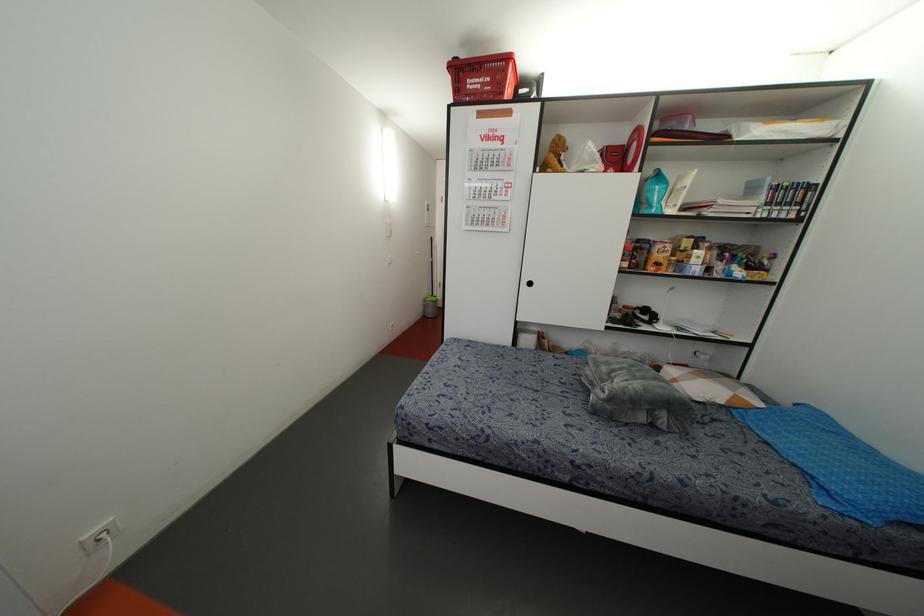
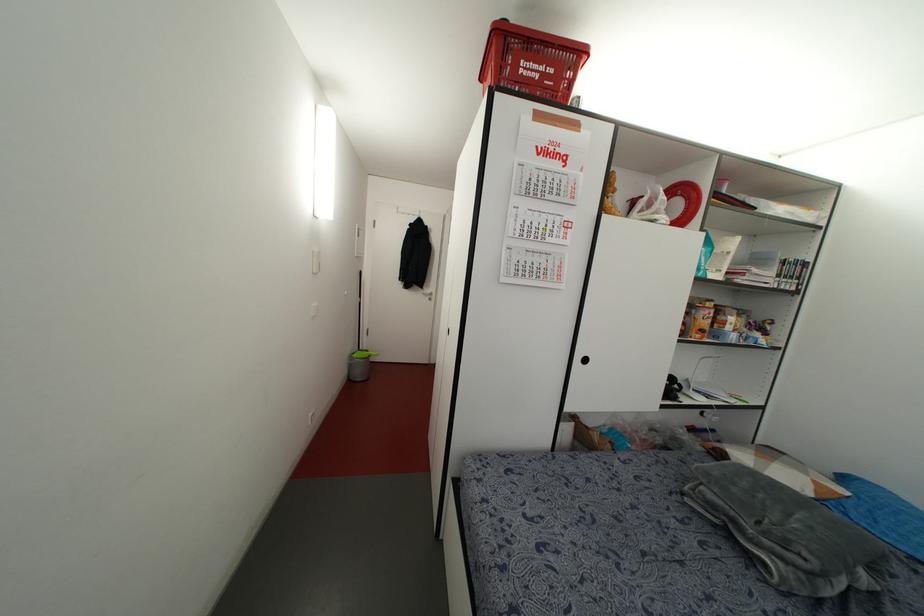
What movement of the cameraman would produce the second image?

The cameraman walked toward left, forward.